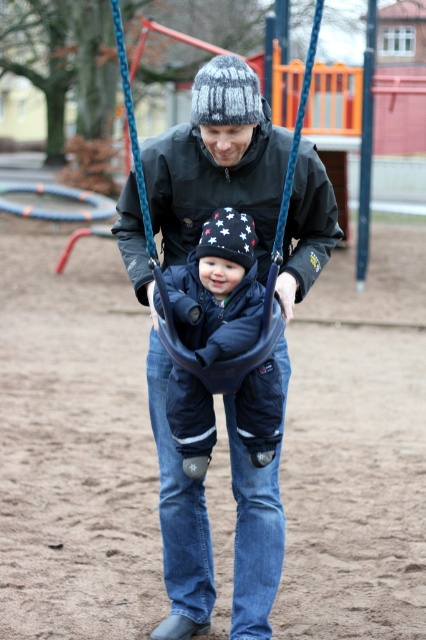
Question: Does dark blue jeans at center have a larger size compared to dark blue fabric baby swing at center?

Choices:
 (A) no
 (B) yes

Answer: (B)

Question: Can you confirm if dark blue jeans at center is positioned below dark blue fabric baby swing at center?

Choices:
 (A) yes
 (B) no

Answer: (A)

Question: Is dark blue jeans at center closer to the viewer compared to dark blue fabric baby swing at center?

Choices:
 (A) yes
 (B) no

Answer: (B)

Question: Which object is farther from the camera taking this photo?

Choices:
 (A) dark blue fabric baby swing at center
 (B) dark blue jeans at center

Answer: (B)

Question: Which object appears closest to the camera in this image?

Choices:
 (A) dark blue jeans at center
 (B) dark blue fabric baby swing at center

Answer: (B)